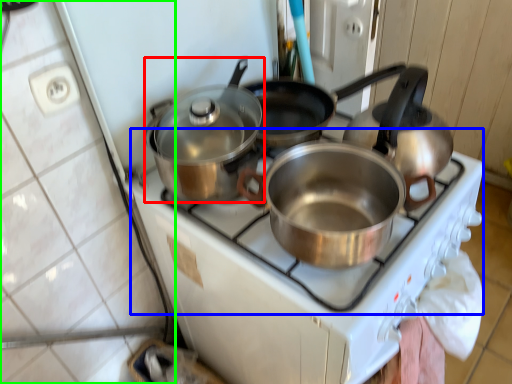
Question: Which object is the closest to the kitchen appliance (highlighted by a red box)? Choose among these: gas stove (highlighted by a blue box) or tile (highlighted by a green box).

Choices:
 (A) gas stove
 (B) tile

Answer: (A)